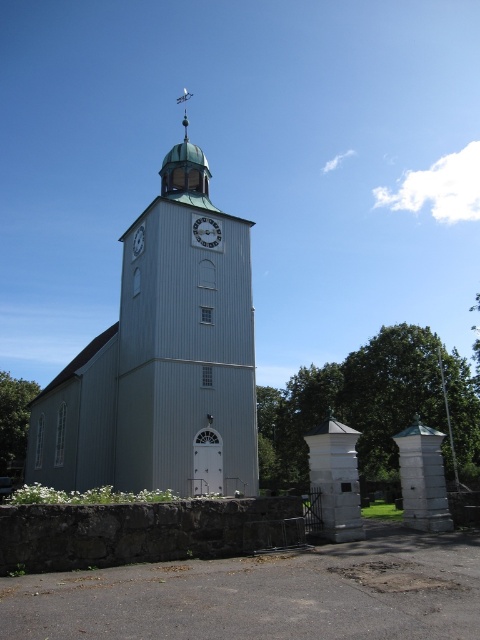
Who is positioned more to the right, white wooden clock at center or white wooden clock at upper center?

From the viewer's perspective, white wooden clock at center appears more on the right side.

Is point (212, 220) farther from viewer compared to point (141, 248)?

No, it is in front of (141, 248).

This screenshot has width=480, height=640. I want to click on white wooden clock at center, so click(x=205, y=232).

Is point (192, 170) closer to viewer compared to point (201, 240)?

No, it is not.

Is green copper spire at upper center below white wooden clock at center?

Actually, green copper spire at upper center is above white wooden clock at center.

Between point (184, 182) and point (212, 240), which one is positioned in front?

Point (212, 240) is in front.

The image size is (480, 640). Find the location of `green copper spire at upper center`. green copper spire at upper center is located at coordinates (184, 163).

Does gray wooden church at center appear under white wooden clock at center?

Yes, gray wooden church at center is below white wooden clock at center.

Between gray wooden church at center and white wooden clock at center, which one is positioned lower?

gray wooden church at center is below.

Identify the location of gray wooden church at center. (163, 362).

I want to click on gray wooden church at center, so click(163, 362).